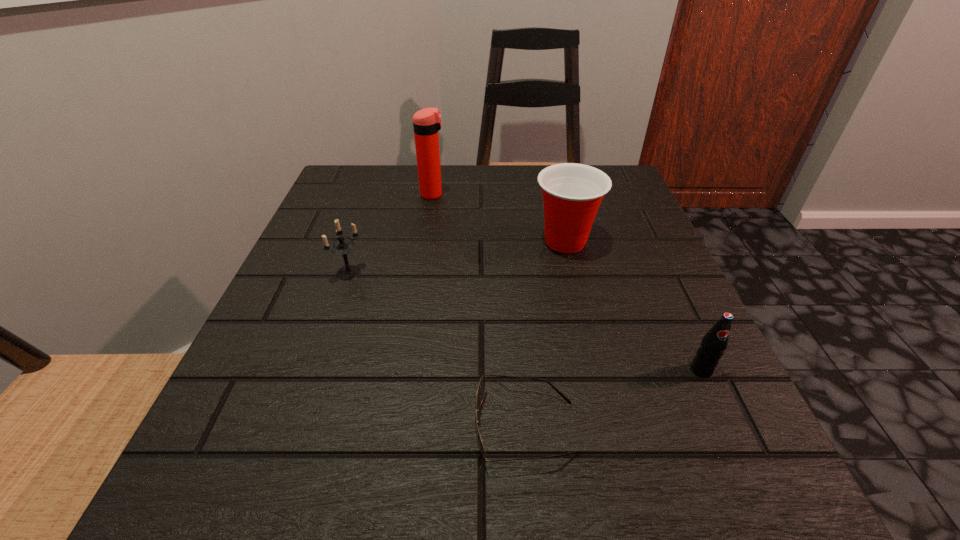
Image resolution: width=960 pixels, height=540 pixels. Find the location of `the farthest object`. the farthest object is located at coordinates (427, 122).

The image size is (960, 540). I want to click on the fourth object from right to left, so click(427, 122).

Identify the location of the second farthest object. Image resolution: width=960 pixels, height=540 pixels. (572, 193).

The image size is (960, 540). What are the coordinates of `the second tallest object` in the screenshot? It's located at (572, 193).

The image size is (960, 540). Find the location of `the leftmost object`. the leftmost object is located at coordinates (342, 247).

You are a GUI agent. You are given a task and a screenshot of the screen. Output one action in this format:
    pyautogui.click(x=<x>, y=<y>)
    Task: Click on the third nearest object
    This screenshot has width=960, height=540.
    Given the screenshot: What is the action you would take?
    pyautogui.click(x=342, y=247)

Where is `the rightmost object`? The image size is (960, 540). the rightmost object is located at coordinates (714, 343).

Find the location of a particular element. Image resolution: width=960 pixels, height=540 pixels. the fourth farthest object is located at coordinates (714, 343).

At what (x,y) coordinates should I click in order to perform the action: click on sunglasses. Please return your answer as a coordinate pair (x, y). The height and width of the screenshot is (540, 960). Looking at the image, I should click on (481, 387).

Find the location of a particular element. the shortest object is located at coordinates (481, 387).